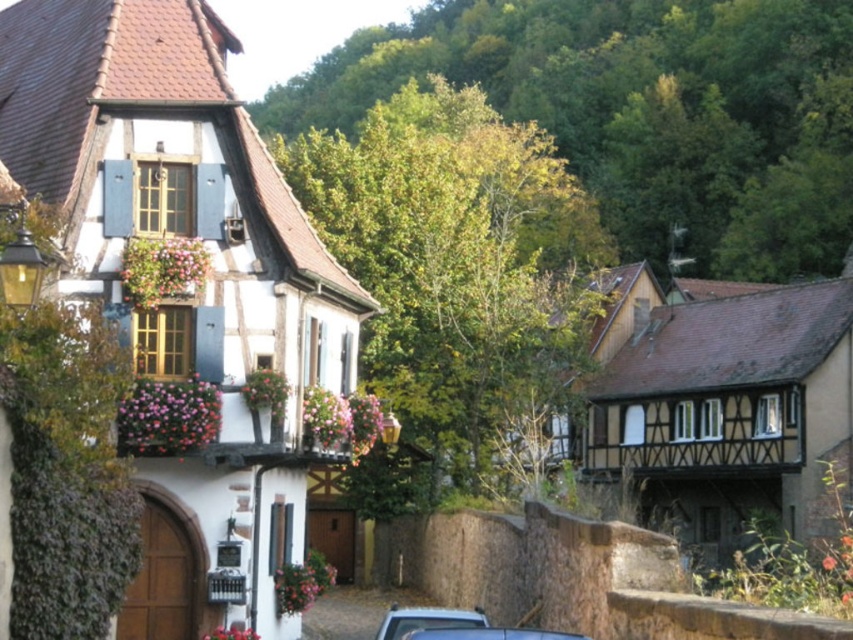
Who is lower down, white wood house at left or metallic silver car at lower center?

Positioned lower is metallic silver car at lower center.

Can you confirm if white wood house at left is wider than metallic silver car at lower center?

Yes.

Is point (364, 298) closer to viewer compared to point (399, 628)?

No, it is not.

Identify the location of white wood house at left. (187, 289).